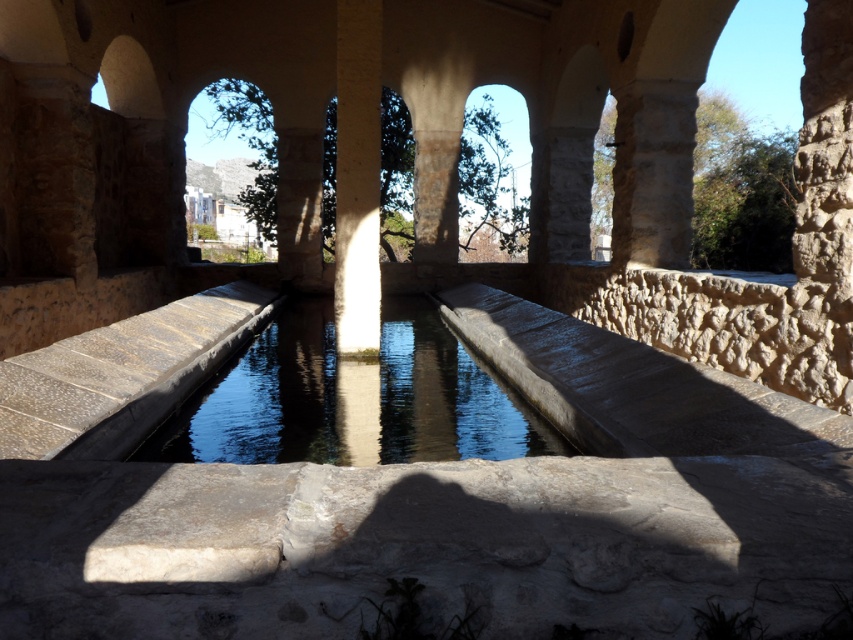
Question: Can you confirm if clear stone water at center is positioned below white stone pillar at center?

Choices:
 (A) yes
 (B) no

Answer: (A)

Question: Which of the following is the farthest from the observer?

Choices:
 (A) (337, 3)
 (B) (306, 371)

Answer: (A)

Question: Can you confirm if clear stone water at center is positioned to the left of white stone pillar at center?

Choices:
 (A) yes
 (B) no

Answer: (B)

Question: Which of the following is the closest to the observer?

Choices:
 (A) pos(339,129)
 (B) pos(276,413)

Answer: (B)

Question: Considering the relative positions of clear stone water at center and white stone pillar at center in the image provided, where is clear stone water at center located with respect to white stone pillar at center?

Choices:
 (A) above
 (B) below

Answer: (B)